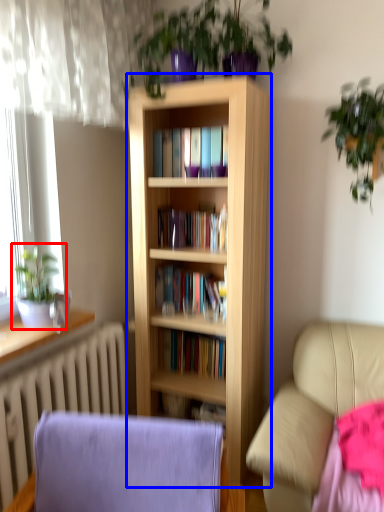
Question: Which point is further to the camera, houseplant (highlighted by a red box) or bookcase (highlighted by a blue box)?

Choices:
 (A) houseplant
 (B) bookcase

Answer: (B)